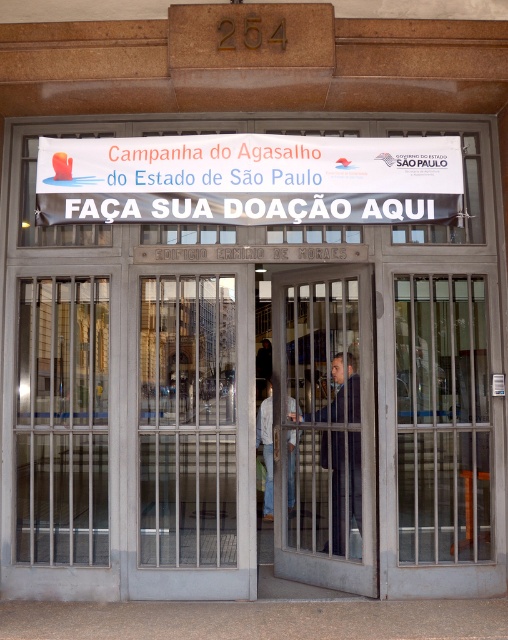
Question: Is metallic gray door at center to the left of metallic glass door at center from the viewer's perspective?

Choices:
 (A) yes
 (B) no

Answer: (A)

Question: Which point is farther to the camera?

Choices:
 (A) (229, 445)
 (B) (264, 419)

Answer: (B)

Question: Which point is farther to the camera?

Choices:
 (A) 333,454
 (B) 184,212
 (C) 270,384
 (D) 184,419

Answer: (C)

Question: Is metallic gray door at center further to camera compared to dark blue suit at center?

Choices:
 (A) yes
 (B) no

Answer: (B)

Question: Which object appears farthest from the camera in this image?

Choices:
 (A) dark blue suit at center
 (B) metallic gray door at center
 (C) white paper banner at center

Answer: (A)

Question: In this image, where is metallic gray door at center located relative to metallic glass door at center?

Choices:
 (A) right
 (B) left

Answer: (B)